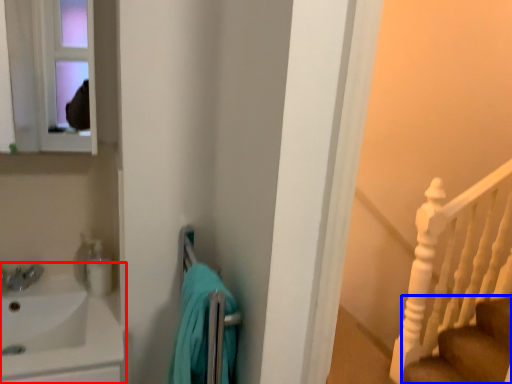
Question: Which point is further to the camera, sink (highlighted by a red box) or stairs (highlighted by a blue box)?

Choices:
 (A) sink
 (B) stairs

Answer: (B)